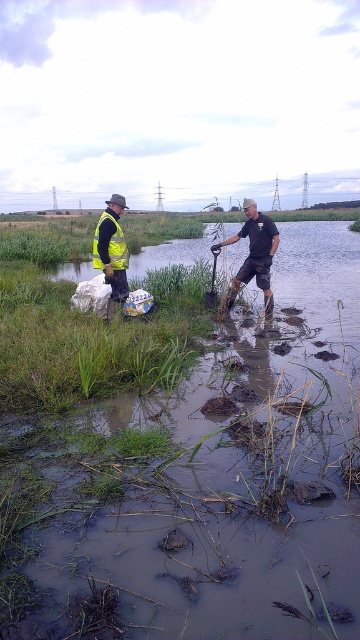
Between brown leather boots at lower center and reflective yellow vest at left, which one appears on the left side from the viewer's perspective?

Positioned to the left is reflective yellow vest at left.

Can you confirm if brown leather boots at lower center is thinner than reflective yellow vest at left?

No.

You are a GUI agent. You are given a task and a screenshot of the screen. Output one action in this format:
    pyautogui.click(x=<x>, y=<y>)
    Task: Click on the brown leather boots at lower center
    The width and height of the screenshot is (360, 640).
    Given the screenshot: What is the action you would take?
    pyautogui.click(x=254, y=253)

Where is `brown leather boots at lower center`? The image size is (360, 640). brown leather boots at lower center is located at coordinates coord(254,253).

Can you confirm if matte yellow vest at left is positioned below brown leather boots at lower center?

Yes.

Is point (236, 477) in front of point (231, 285)?

That is True.

Is point (205, 276) positioned behind point (257, 227)?

Yes, point (205, 276) is behind point (257, 227).

The width and height of the screenshot is (360, 640). Find the location of `matte yellow vest at left`. matte yellow vest at left is located at coordinates (183, 461).

Can you confirm if matte yellow vest at left is smaller than reflective yellow vest at left?

No, matte yellow vest at left is not smaller than reflective yellow vest at left.

Does matte yellow vest at left have a lesser width compared to reflective yellow vest at left?

Incorrect, matte yellow vest at left's width is not less than reflective yellow vest at left's.

Locate an element on the screen. This screenshot has width=360, height=640. matte yellow vest at left is located at coordinates (183, 461).